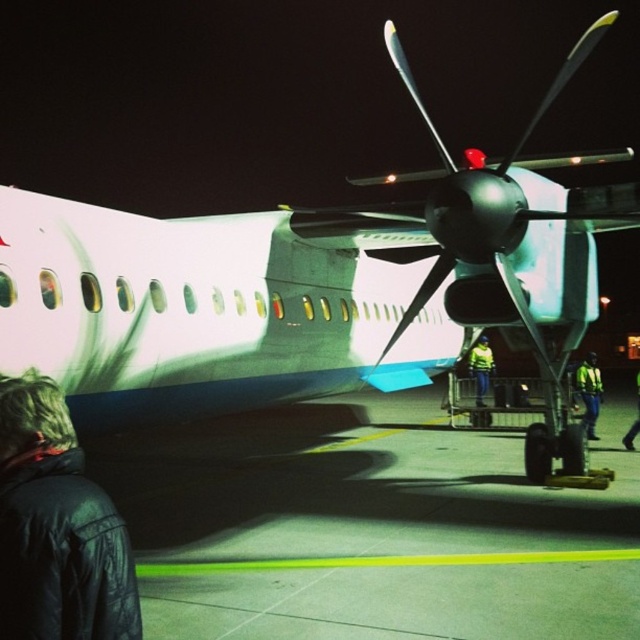
You are a pilot who needs to retrieve your keys from the yellow reflective vest at center. You are currently standing near the black leather jacket at lower left. Can you reach the vest without moving past the jacket?

The black leather jacket at lower left is closer to the viewer than the yellow reflective vest at center, so you would need to move past the jacket to reach the vest.

You are a pilot preparing to board the small propeller airplane at night. You notice two yellow reflective items at the lower right corner of your vision. Which one is shorter between the reflective yellow safety vest at lower right and the yellow reflective vest at lower right?

The reflective yellow safety vest at lower right is not as tall as the yellow reflective vest at lower right, so the reflective yellow safety vest at lower right is shorter.

You are a pilot preparing to board the airplane. You see the black leather jacket at lower left and the yellow reflective vest at center. Which item is closer to the airplane?

The yellow reflective vest at center is closer to the airplane because the black leather jacket at lower left is above it, meaning the vest is positioned lower and nearer to the aircraft.